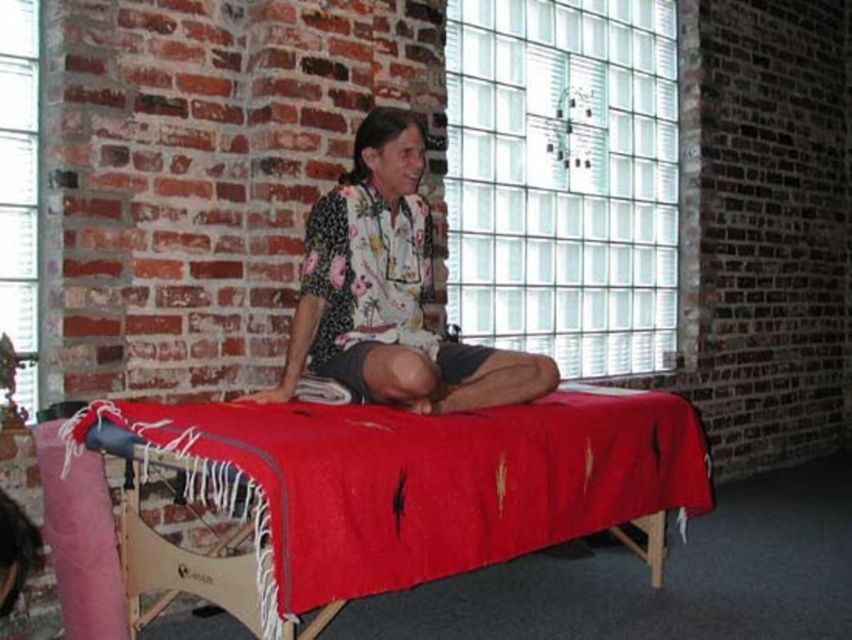
Question: Among these objects, which one is farthest from the camera?

Choices:
 (A) floral fabric shirt at center
 (B) red woven blanket at center

Answer: (A)

Question: Does red woven blanket at center have a larger size compared to floral fabric shirt at center?

Choices:
 (A) no
 (B) yes

Answer: (B)

Question: Among these points, which one is nearest to the camera?

Choices:
 (A) (384, 360)
 (B) (295, 428)

Answer: (B)

Question: Among these points, which one is nearest to the camera?

Choices:
 (A) (711, 492)
 (B) (396, 163)

Answer: (B)

Question: Can you confirm if red woven blanket at center is wider than floral fabric shirt at center?

Choices:
 (A) no
 (B) yes

Answer: (B)

Question: Is red woven blanket at center smaller than floral fabric shirt at center?

Choices:
 (A) yes
 (B) no

Answer: (B)